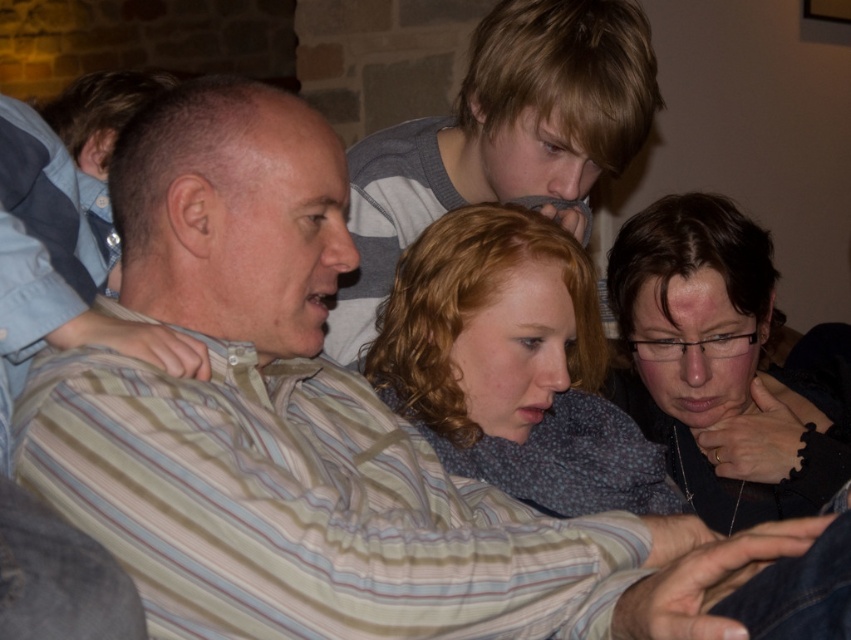
Where is the fluffy gray sweater at center located in the image?

The fluffy gray sweater at center is located at point (512, 365) in the image.